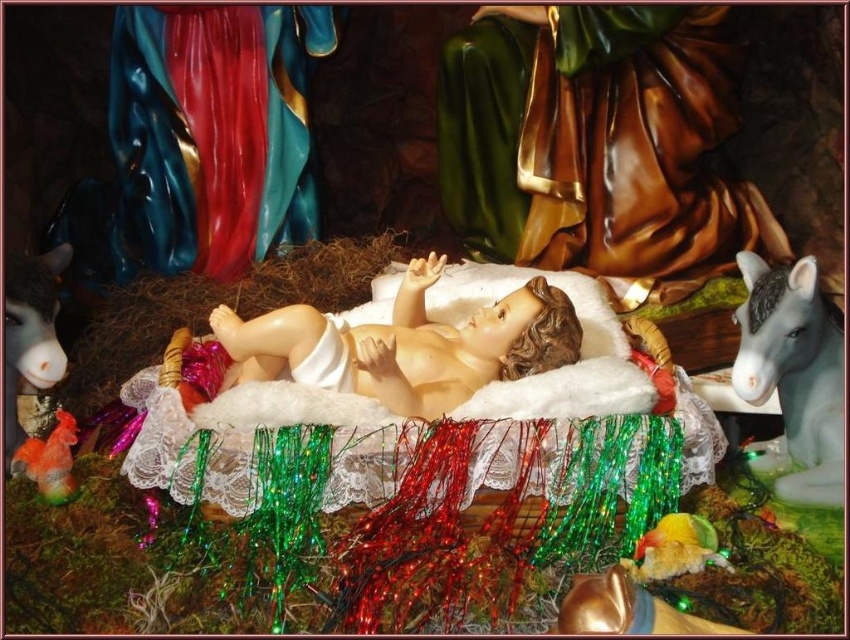
You are setting up a nativity scene and notice the white glossy horse at right and the brown fur stuffed animal at left. Which object is placed higher in the scene?

The brown fur stuffed animal at left is positioned higher than the white glossy horse at right because it is above it.

You are setting up a nativity scene and need to place the white glossy horse at right and the multicolored plastic parrot at lower right on a shelf that is 1 meter wide. Based on their widths, can both items fit side by side without overlapping?

The white glossy horse at right might be wider than the multicolored plastic parrot at lower right, so there is uncertainty about whether both can fit side by side on the 1 meter wide shelf. Measure their actual widths to confirm.

You are setting up a nativity scene and need to place the brown fur stuffed animal at left and the multicolored plastic parrot at lower right. The instructions say that these two items must be at least 30 inches apart. Based on the image, will their current placement meet the requirement?

The distance between the brown fur stuffed animal at left and the multicolored plastic parrot at lower right is 28.50 inches, which is less than the required 30 inches. Therefore, their current placement does not meet the requirement.